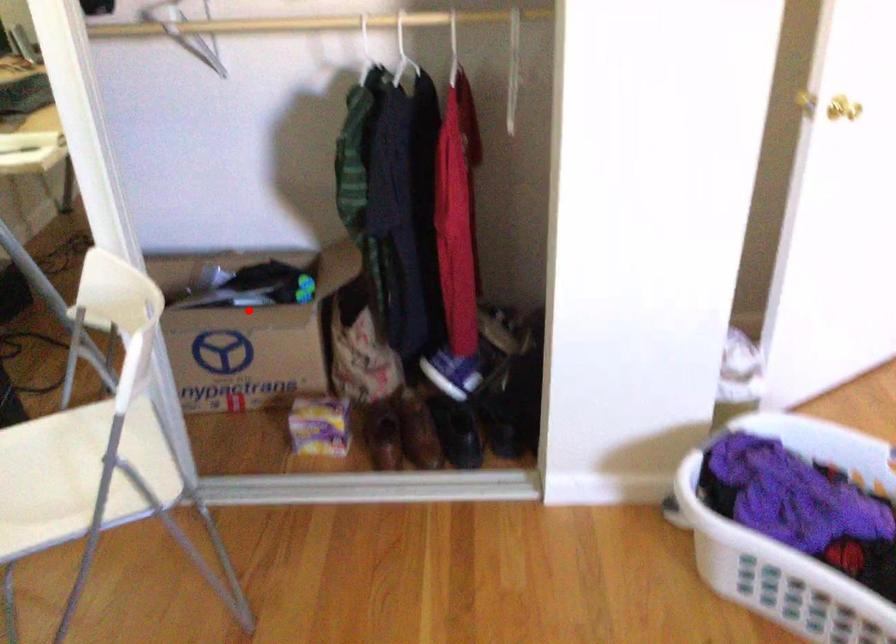
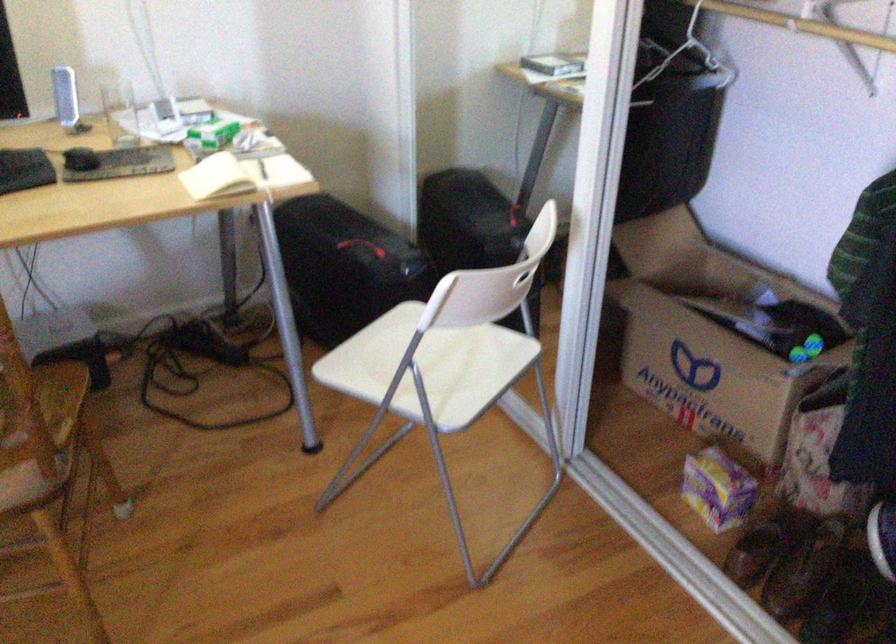
Question: A red point is marked in image1. In image2, is the corresponding 3D point closer to the camera or farther? Reply with the corresponding letter.

Choices:
 (A) The corresponding 3D point is closer.
 (B) The corresponding 3D point is farther.

Answer: (A)